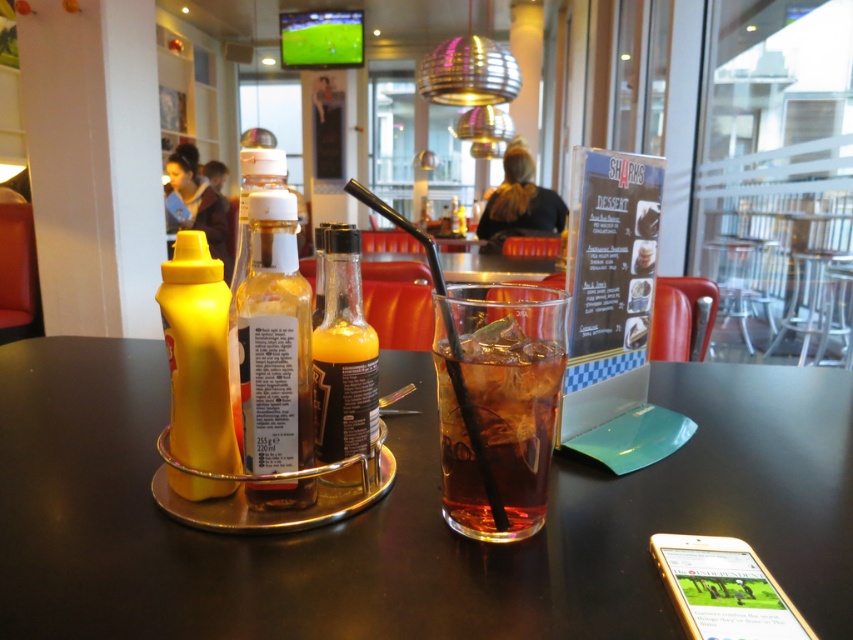
Can you confirm if translucent glass at center is thinner than translucent plastic bottle at center?

In fact, translucent glass at center might be wider than translucent plastic bottle at center.

Does translucent glass at center have a larger size compared to translucent plastic bottle at center?

Yes, translucent glass at center is bigger than translucent plastic bottle at center.

This screenshot has width=853, height=640. I want to click on translucent glass at center, so click(497, 433).

This screenshot has height=640, width=853. I want to click on translucent glass at center, so click(x=497, y=433).

Is point (270, 225) positioned in front of point (341, 381)?

Yes, it is in front of point (341, 381).

Where is `translucent plastic bottle at center`? The image size is (853, 640). translucent plastic bottle at center is located at coordinates (274, 340).

Consider the image. Who is higher up, translucent glass at center or translucent glass bottle at center?

translucent glass bottle at center is higher up.

Does translucent glass at center appear on the left side of translucent glass bottle at center?

Incorrect, translucent glass at center is not on the left side of translucent glass bottle at center.

Who is more distant from viewer, (519,340) or (335,420)?

Positioned behind is point (335,420).

The image size is (853, 640). Identify the location of translucent glass at center. (497, 433).